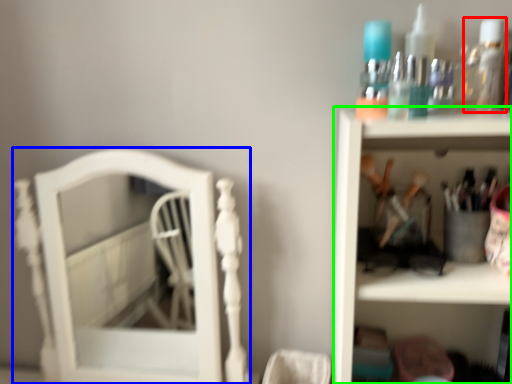
Question: Which object is positioned farthest from mouthwash (highlighted by a red box)? Select from furniture (highlighted by a blue box) and shelf (highlighted by a green box).

Choices:
 (A) furniture
 (B) shelf

Answer: (A)